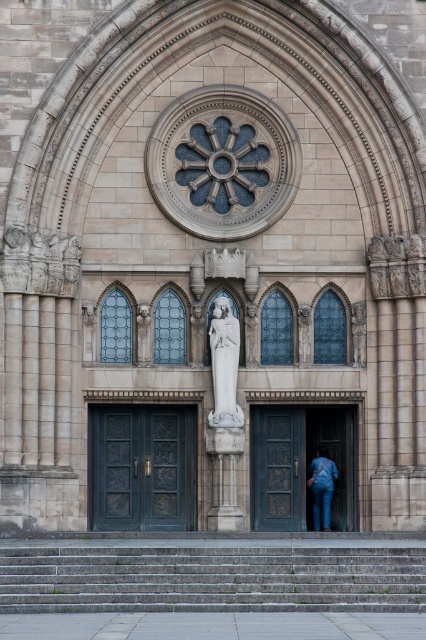
Question: Is jeans at center smaller than stone statue at right?

Choices:
 (A) yes
 (B) no

Answer: (B)

Question: Which object is positioned farthest from the gray concrete stairs at lower center?

Choices:
 (A) white marble statue at center
 (B) jeans at center
 (C) stone statue at right
 (D) dark brown wood door at center

Answer: (C)

Question: Can you confirm if dark wood door at center is positioned to the left of jeans at center?

Choices:
 (A) no
 (B) yes

Answer: (B)

Question: Does gray concrete stairs at lower center have a lesser width compared to jeans at center?

Choices:
 (A) no
 (B) yes

Answer: (A)

Question: Among these points, which one is nearest to the camera?

Choices:
 (A) (20, 604)
 (B) (327, 452)

Answer: (A)

Question: Among these objects, which one is farthest from the camera?

Choices:
 (A) dark wood door at center
 (B) white marble statue at center
 (C) stone statue at right

Answer: (C)